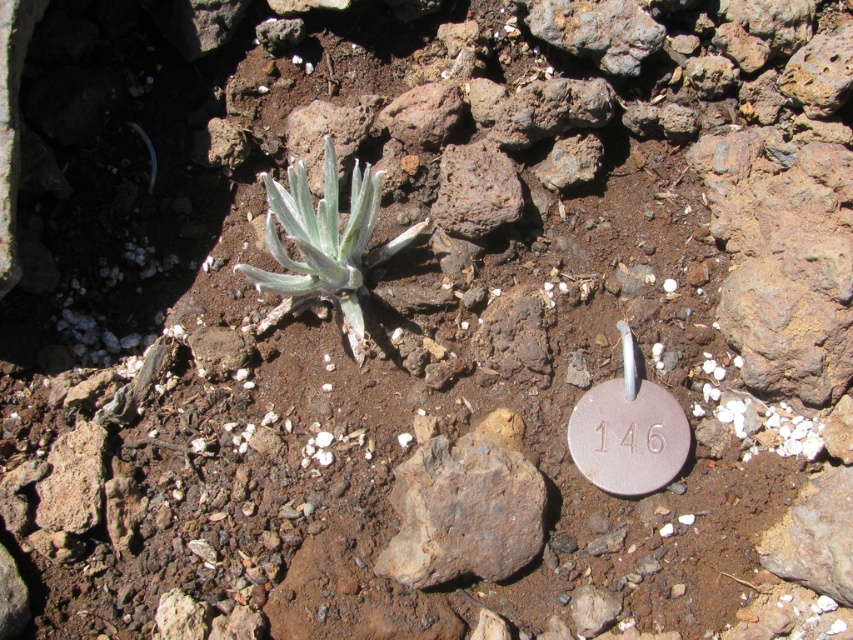
Question: Which point is closer to the camera?

Choices:
 (A) silvery-green succulent at center
 (B) gray rough rock at center

Answer: (A)

Question: Among these objects, which one is nearest to the camera?

Choices:
 (A) gray rough rock at center
 (B) silvery-green succulent at center

Answer: (B)

Question: Can you confirm if gray rough rock at center is positioned to the left of silvery-green succulent at center?

Choices:
 (A) no
 (B) yes

Answer: (A)

Question: Is gray rough rock at center behind silvery-green succulent at center?

Choices:
 (A) no
 (B) yes

Answer: (B)

Question: Does gray rough rock at center lie behind silvery-green succulent at center?

Choices:
 (A) no
 (B) yes

Answer: (B)